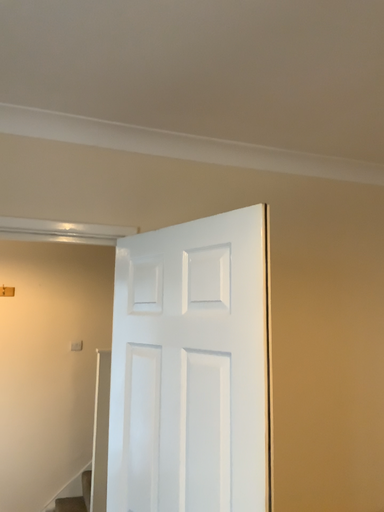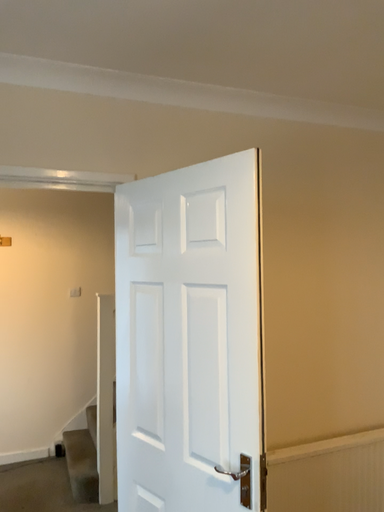
Question: Which way did the camera rotate in the video?

Choices:
 (A) rotated upward
 (B) rotated downward

Answer: (B)